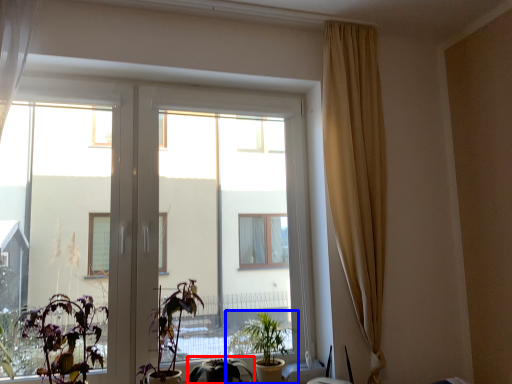
Question: Which object is further to the camera taking this photo, houseplant (highlighted by a red box) or houseplant (highlighted by a blue box)?

Choices:
 (A) houseplant
 (B) houseplant

Answer: (B)